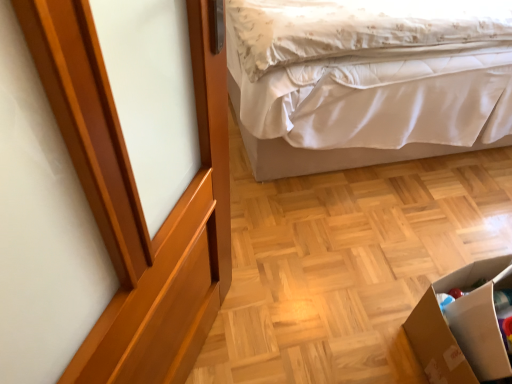
What do you see at coordinates (139, 199) in the screenshot? The width and height of the screenshot is (512, 384). I see `glossy wood screen door at upper left` at bounding box center [139, 199].

What do you see at coordinates (368, 81) in the screenshot?
I see `white satin bed at upper right` at bounding box center [368, 81].

Measure the distance between cardboard box at lower right and camera.

36.96 inches.

You are a GUI agent. You are given a task and a screenshot of the screen. Output one action in this format:
    pyautogui.click(x=<x>, y=<y>)
    Task: Click on the glossy wood screen door at upper left
    
    Given the screenshot: What is the action you would take?
    pyautogui.click(x=139, y=199)

Considering the relative sizes of cardboard box at lower right and white satin bed at upper right in the image provided, is cardboard box at lower right thinner than white satin bed at upper right?

Correct, the width of cardboard box at lower right is less than that of white satin bed at upper right.

From the picture: Is cardboard box at lower right oriented away from white satin bed at upper right?

cardboard box at lower right is not turned away from white satin bed at upper right.

From a real-world perspective, is cardboard box at lower right under white satin bed at upper right?

Yes.

Between cardboard box at lower right and glossy wood screen door at upper left, which one appears on the right side from the viewer's perspective?

cardboard box at lower right.

Is cardboard box at lower right facing away from glossy wood screen door at upper left?

cardboard box at lower right is not turned away from glossy wood screen door at upper left.

Identify the location of screen door on the left of the cardboard box at lower right. Image resolution: width=512 pixels, height=384 pixels. (139, 199).

Looking at this image, from the image's perspective, is cardboard box at lower right positioned above or below glossy wood screen door at upper left?

cardboard box at lower right is situated lower than glossy wood screen door at upper left in the image.

Which object is wider, glossy wood screen door at upper left or white satin bed at upper right?

white satin bed at upper right is wider.

Measure the distance between glossy wood screen door at upper left and white satin bed at upper right.

The distance of glossy wood screen door at upper left from white satin bed at upper right is 32.54 inches.

In the image, is glossy wood screen door at upper left positioned in front of or behind white satin bed at upper right?

glossy wood screen door at upper left is positioned closer to the viewer than white satin bed at upper right.

Does white satin bed at upper right have a greater height compared to cardboard box at lower right?

Yes.

Which object is positioned more to the right, white satin bed at upper right or cardboard box at lower right?

Positioned to the right is white satin bed at upper right.

Find the location of a particular element. The height and width of the screenshot is (384, 512). cardboard box that is on the left side of white satin bed at upper right is located at coordinates (462, 327).

From a real-world perspective, is white satin bed at upper right positioned above or below cardboard box at lower right?

In terms of real-world spatial position, white satin bed at upper right is above cardboard box at lower right.

Is cardboard box at lower right at the back of glossy wood screen door at upper left?

No, glossy wood screen door at upper left's orientation is not away from cardboard box at lower right.

Can cardboard box at lower right be found inside glossy wood screen door at upper left?

No, cardboard box at lower right is located outside of glossy wood screen door at upper left.

How distant is glossy wood screen door at upper left from cardboard box at lower right?

glossy wood screen door at upper left is 74.22 centimeters from cardboard box at lower right.

Is glossy wood screen door at upper left smaller than cardboard box at lower right?

Actually, glossy wood screen door at upper left might be larger than cardboard box at lower right.

Is point (395, 92) behind point (74, 359)?

Yes.

Would you say white satin bed at upper right is a long distance from glossy wood screen door at upper left?

No, white satin bed at upper right is in close proximity to glossy wood screen door at upper left.

From a real-world perspective, relative to glossy wood screen door at upper left, is white satin bed at upper right vertically above or below?

In terms of real-world spatial position, white satin bed at upper right is below glossy wood screen door at upper left.

Is white satin bed at upper right further to the viewer compared to glossy wood screen door at upper left?

Yes, white satin bed at upper right is further from the camera.

Locate an element on the screen. This screenshot has width=512, height=384. cardboard box to the left of white satin bed at upper right is located at coordinates (462, 327).

Where is `screen door in front of the cardboard box at lower right`? This screenshot has height=384, width=512. screen door in front of the cardboard box at lower right is located at coordinates (139, 199).

From the image, which object appears to be nearer to cardboard box at lower right, white satin bed at upper right or glossy wood screen door at upper left?

glossy wood screen door at upper left is positioned closer to the anchor cardboard box at lower right.

Considering their positions, is glossy wood screen door at upper left positioned further to white satin bed at upper right than cardboard box at lower right?

glossy wood screen door at upper left lies further to white satin bed at upper right than the other object.

From the image, which object appears to be nearer to glossy wood screen door at upper left, white satin bed at upper right or cardboard box at lower right?

cardboard box at lower right lies closer to glossy wood screen door at upper left than the other object.

Which object lies further to the anchor point white satin bed at upper right, cardboard box at lower right or glossy wood screen door at upper left?

glossy wood screen door at upper left is further to white satin bed at upper right.

When comparing their distances from glossy wood screen door at upper left, does cardboard box at lower right or white satin bed at upper right seem further?

white satin bed at upper right lies further to glossy wood screen door at upper left than the other object.

Based on their spatial positions, is glossy wood screen door at upper left or white satin bed at upper right closer to cardboard box at lower right?

Based on the image, glossy wood screen door at upper left appears to be nearer to cardboard box at lower right.

What are the coordinates of `screen door between white satin bed at upper right and cardboard box at lower right vertically` in the screenshot? It's located at (139, 199).